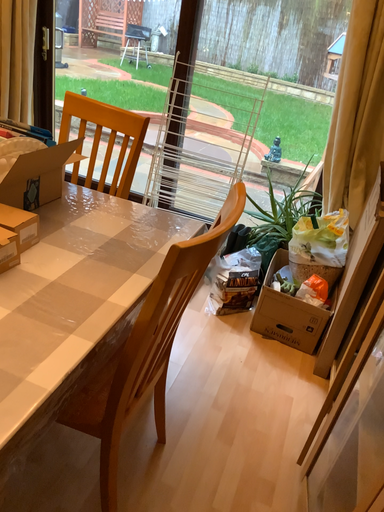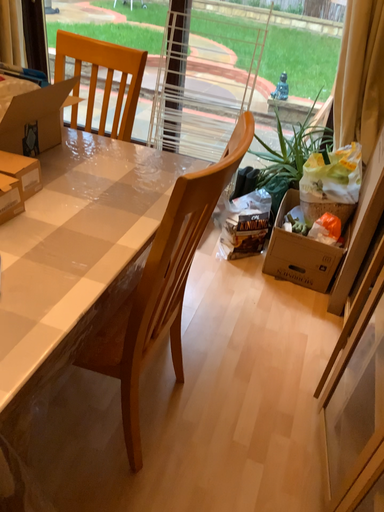
Question: How did the camera likely rotate when shooting the video?

Choices:
 (A) rotated upward
 (B) rotated downward

Answer: (B)